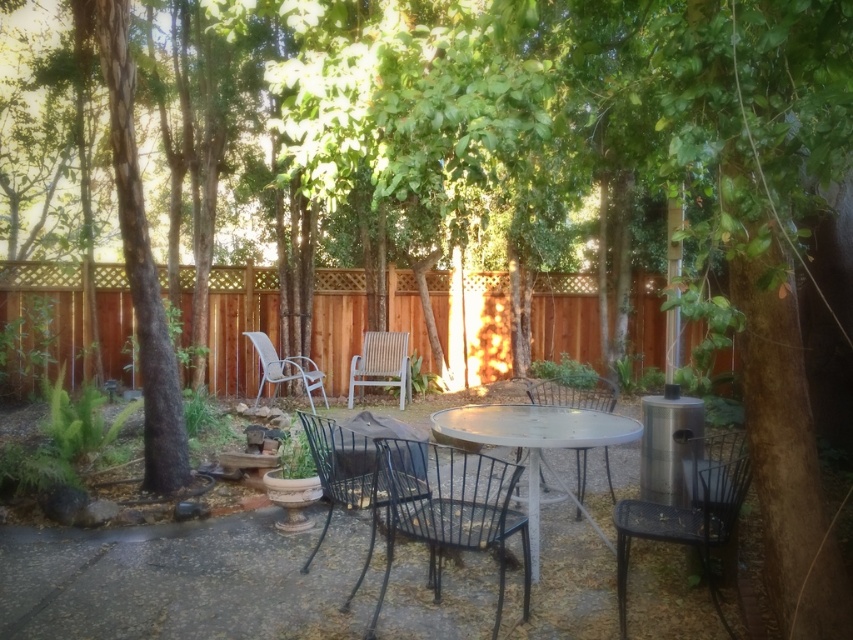
Question: Is black metal chair at lower right in front of white metal table at center?

Choices:
 (A) no
 (B) yes

Answer: (B)

Question: Which of these objects is positioned farthest from the black wrought iron chair at center?

Choices:
 (A) black metal chair at lower right
 (B) metallic black chair at center
 (C) white metal table at center
 (D) black metal chair at center

Answer: (B)

Question: Which object is the farthest from the green textured bark at left?

Choices:
 (A) light brown woven chair at center
 (B) white plastic chair at left

Answer: (A)

Question: Is green textured bark at left closer to the viewer compared to white metal table at center?

Choices:
 (A) no
 (B) yes

Answer: (A)

Question: Based on their relative distances, which object is nearer to the light brown woven chair at center?

Choices:
 (A) black wrought iron chair at center
 (B) metallic black chair at center
 (C) black metal chair at lower right

Answer: (B)

Question: Can you confirm if black metal chair at lower right is positioned to the left of black wrought iron chair at center?

Choices:
 (A) no
 (B) yes

Answer: (A)